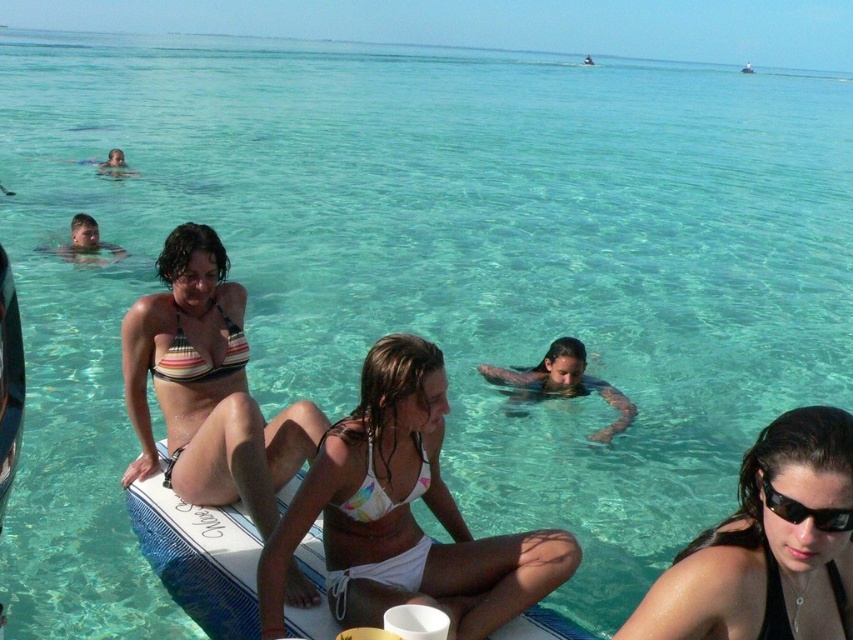
Question: Among these objects, which one is farthest from the camera?

Choices:
 (A) striped fabric bikini at upper left
 (B) white bikini top at center
 (C) white bikini at center

Answer: (A)

Question: Can you confirm if black matte swimsuit at lower right is wider than white bikini top at center?

Choices:
 (A) no
 (B) yes

Answer: (B)

Question: Can you confirm if white bikini at center is positioned to the left of black plastic sunglasses at lower right?

Choices:
 (A) yes
 (B) no

Answer: (A)

Question: Among these points, which one is nearest to the camera?

Choices:
 (A) (183, 333)
 (B) (368, 499)
 (C) (148, 410)

Answer: (B)

Question: Does black matte swimsuit at lower right lie behind black plastic sunglasses at lower right?

Choices:
 (A) no
 (B) yes

Answer: (B)

Question: Which object is closer to the camera taking this photo?

Choices:
 (A) black matte swimsuit at lower right
 (B) striped bikini top at center
 (C) white bikini top at center

Answer: (A)